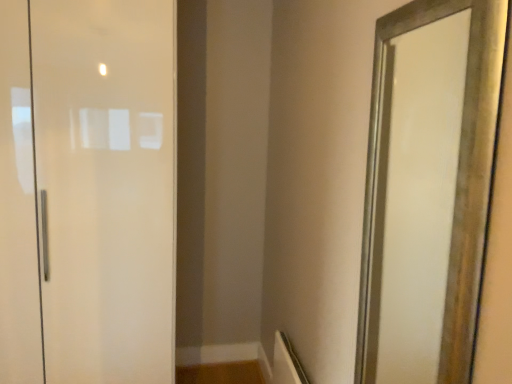
Question: Can you confirm if gold-framed mirror at right is taller than matte white door at left?

Choices:
 (A) no
 (B) yes

Answer: (A)

Question: From the image's perspective, is gold-framed mirror at right below matte white door at left?

Choices:
 (A) yes
 (B) no

Answer: (A)

Question: Is gold-framed mirror at right smaller than matte white door at left?

Choices:
 (A) no
 (B) yes

Answer: (B)

Question: Is gold-framed mirror at right to the left of matte white door at left from the viewer's perspective?

Choices:
 (A) no
 (B) yes

Answer: (A)

Question: From a real-world perspective, is gold-framed mirror at right positioned over matte white door at left based on gravity?

Choices:
 (A) yes
 (B) no

Answer: (A)

Question: Is gold-framed mirror at right bigger than matte white door at left?

Choices:
 (A) no
 (B) yes

Answer: (A)

Question: Is matte white door at left thinner than gold-framed mirror at right?

Choices:
 (A) no
 (B) yes

Answer: (A)

Question: Can you confirm if matte white door at left is taller than gold-framed mirror at right?

Choices:
 (A) no
 (B) yes

Answer: (B)

Question: From a real-world perspective, does matte white door at left stand above gold-framed mirror at right?

Choices:
 (A) no
 (B) yes

Answer: (A)

Question: Is matte white door at left to the left of gold-framed mirror at right from the viewer's perspective?

Choices:
 (A) no
 (B) yes

Answer: (B)

Question: Is matte white door at left not within gold-framed mirror at right?

Choices:
 (A) yes
 (B) no

Answer: (A)

Question: Is matte white door at left turned away from gold-framed mirror at right?

Choices:
 (A) no
 (B) yes

Answer: (A)

Question: Is point (400, 249) closer or farther from the camera than point (157, 240)?

Choices:
 (A) closer
 (B) farther

Answer: (B)